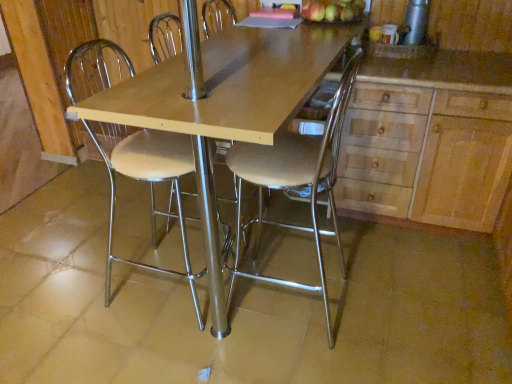
At what (x,y) coordinates should I click in order to perform the action: click on metallic silver stool at center, the first chair in the left-to-right sequence. Please return your answer as a coordinate pair (x, y). Looking at the image, I should click on (148, 182).

Locate an element on the screen. Image resolution: width=512 pixels, height=384 pixels. green matte apples at upper right is located at coordinates (332, 10).

This screenshot has height=384, width=512. What do you see at coordinates (296, 179) in the screenshot?
I see `metallic silver chair at center, which is the 2th chair in left-to-right order` at bounding box center [296, 179].

What do you see at coordinates (415, 22) in the screenshot? The height and width of the screenshot is (384, 512). I see `silver metallic thermos at upper right` at bounding box center [415, 22].

At what (x,y) coordinates should I click in order to perform the action: click on wooden cabinet at right. Please return your answer as a coordinate pair (x, y). The image size is (512, 384). Looking at the image, I should click on (434, 136).

This screenshot has height=384, width=512. Find the location of `wooden table at center`. wooden table at center is located at coordinates (225, 107).

Which is in front, point (477, 224) or point (68, 118)?

The point (477, 224) is closer.

Is wooden cabinet at right in contact with wooden table at center?

No.

Is wooden cabinet at right wider or thinner than wooden table at center?

Considering their sizes, wooden cabinet at right looks slimmer than wooden table at center.

From a real-world perspective, is wooden cabinet at right physically below wooden table at center?

Indeed, from a real-world perspective, wooden cabinet at right is positioned beneath wooden table at center.

Which point is more distant from viewer, (413, 18) or (334, 11)?

The point (334, 11) is farther.

Is silver metallic thermos at upper right far away from green matte apples at upper right?

Actually, silver metallic thermos at upper right and green matte apples at upper right are a little close together.

How different are the orientations of silver metallic thermos at upper right and green matte apples at upper right in degrees?

5.13 degrees.

Considering the relative sizes of metallic silver chair at center, which is the 1th chair from right to left, and silver metallic thermos at upper right in the image provided, is metallic silver chair at center, which is the 1th chair from right to left, smaller than silver metallic thermos at upper right?

Actually, metallic silver chair at center, which is the 1th chair from right to left, might be larger than silver metallic thermos at upper right.

Looking at this image, which object is wider, metallic silver chair at center, which is the 1th chair from right to left, or silver metallic thermos at upper right?

metallic silver chair at center, which is the 1th chair from right to left.

From the image's perspective, is metallic silver chair at center, which is the 2th chair in left-to-right order, located beneath silver metallic thermos at upper right?

Correct, metallic silver chair at center, which is the 2th chair in left-to-right order, appears lower than silver metallic thermos at upper right in the image.

Image resolution: width=512 pixels, height=384 pixels. I want to click on appliance on the right of metallic silver chair at center, which is the 2th chair in left-to-right order, so click(415, 22).

Is wooden table at center not close to metallic silver chair at center, which is the 1th chair from right to left?

They are positioned close to each other.

Would you say wooden table at center is outside metallic silver chair at center, which is the 1th chair from right to left?

wooden table at center lies outside metallic silver chair at center, which is the 1th chair from right to left,'s area.

From the image's perspective, between wooden table at center and metallic silver chair at center, which is the 2th chair in left-to-right order, who is located below?

metallic silver chair at center, which is the 2th chair in left-to-right order, appears lower in the image.

Which of these two, wooden table at center or metallic silver chair at center, which is the 1th chair from right to left, stands taller?

metallic silver chair at center, which is the 1th chair from right to left, is taller.

Considering the positions of objects metallic silver stool at center, which is the second chair in right-to-left order, and metallic silver chair at center, which is the 1th chair from right to left, in the image provided, who is more to the left, metallic silver stool at center, which is the second chair in right-to-left order, or metallic silver chair at center, which is the 1th chair from right to left,?

Answer: From the viewer's perspective, metallic silver stool at center, which is the second chair in right-to-left order, appears more on the left side.

In the scene shown: Who is more distant, metallic silver stool at center, which is the second chair in right-to-left order, or metallic silver chair at center, which is the 1th chair from right to left?

metallic silver stool at center, which is the second chair in right-to-left order, is further from the camera.

At what (x,y) coordinates should I click in order to perform the action: click on chair that appears below the metallic silver chair at center, which is the 1th chair from right to left (from a real-world perspective). Please return your answer as a coordinate pair (x, y). Image resolution: width=512 pixels, height=384 pixels. Looking at the image, I should click on (148, 182).

How many degrees apart are the facing directions of metallic silver stool at center, the first chair in the left-to-right sequence, and metallic silver chair at center, which is the 2th chair in left-to-right order?

The facing directions of metallic silver stool at center, the first chair in the left-to-right sequence, and metallic silver chair at center, which is the 2th chair in left-to-right order, are 179 degrees apart.

Does metallic silver stool at center, the first chair in the left-to-right sequence, contain silver metallic thermos at upper right?

No, silver metallic thermos at upper right is not surrounded by metallic silver stool at center, the first chair in the left-to-right sequence.

Can you confirm if metallic silver stool at center, which is the second chair in right-to-left order, is smaller than silver metallic thermos at upper right?

Actually, metallic silver stool at center, which is the second chair in right-to-left order, might be larger than silver metallic thermos at upper right.

Between metallic silver stool at center, which is the second chair in right-to-left order, and silver metallic thermos at upper right, which one has less height?

With less height is silver metallic thermos at upper right.

From the image's perspective, which is above, metallic silver stool at center, which is the second chair in right-to-left order, or silver metallic thermos at upper right?

silver metallic thermos at upper right.

Which of these two, metallic silver chair at center, which is the 2th chair in left-to-right order, or wooden table at center, stands taller?

metallic silver chair at center, which is the 2th chair in left-to-right order.

Based on their sizes in the image, would you say metallic silver chair at center, which is the 2th chair in left-to-right order, is bigger or smaller than wooden table at center?

Considering their sizes, metallic silver chair at center, which is the 2th chair in left-to-right order, takes up less space than wooden table at center.

Is metallic silver chair at center, which is the 2th chair in left-to-right order, outside of wooden table at center?

That's incorrect, metallic silver chair at center, which is the 2th chair in left-to-right order, is not completely outside wooden table at center.

Identify the location of cabinetry that appears below the wooden table at center (from a real-world perspective). (434, 136).

At what (x,y) coordinates should I click in order to perform the action: click on apple above the silver metallic thermos at upper right (from a real-world perspective). Please return your answer as a coordinate pair (x, y). The width and height of the screenshot is (512, 384). Looking at the image, I should click on (332, 10).

Looking at the image, which one is located closer to wooden table at center, wooden cabinet at right or green matte apples at upper right?

green matte apples at upper right lies closer to wooden table at center than the other object.

Looking at the image, which one is located closer to wooden cabinet at right, metallic silver chair at center, which is the 2th chair in left-to-right order, or silver metallic thermos at upper right?

metallic silver chair at center, which is the 2th chair in left-to-right order, is closer to wooden cabinet at right.

From the image, which object appears to be nearer to green matte apples at upper right, wooden table at center or silver metallic thermos at upper right?

silver metallic thermos at upper right is positioned closer to the anchor green matte apples at upper right.

From the image, which object appears to be nearer to wooden cabinet at right, silver metallic thermos at upper right or metallic silver chair at center, which is the 2th chair in left-to-right order?

metallic silver chair at center, which is the 2th chair in left-to-right order, lies closer to wooden cabinet at right than the other object.

Considering their positions, is wooden table at center positioned closer to metallic silver stool at center, the first chair in the left-to-right sequence, than wooden cabinet at right?

wooden table at center is closer to metallic silver stool at center, the first chair in the left-to-right sequence.

From the image, which object appears to be nearer to green matte apples at upper right, wooden cabinet at right or wooden table at center?

wooden table at center lies closer to green matte apples at upper right than the other object.

Based on their spatial positions, is wooden cabinet at right or green matte apples at upper right further from metallic silver stool at center, which is the second chair in right-to-left order?

wooden cabinet at right lies further to metallic silver stool at center, which is the second chair in right-to-left order, than the other object.

From the image, which object appears to be farther from silver metallic thermos at upper right, wooden table at center or wooden cabinet at right?

wooden table at center.

Find the location of a particular element. table between metallic silver stool at center, the first chair in the left-to-right sequence, and silver metallic thermos at upper right from left to right is located at coordinates (225, 107).

The image size is (512, 384). In order to click on cabinetry positioned between metallic silver chair at center, which is the 2th chair in left-to-right order, and silver metallic thermos at upper right from near to far in this screenshot , I will do `click(434, 136)`.

This screenshot has width=512, height=384. I want to click on appliance situated between metallic silver stool at center, the first chair in the left-to-right sequence, and wooden cabinet at right from left to right, so click(x=415, y=22).

Locate an element on the screen. This screenshot has width=512, height=384. chair between green matte apples at upper right and metallic silver chair at center, which is the 1th chair from right to left, in the up-down direction is located at coordinates (148, 182).